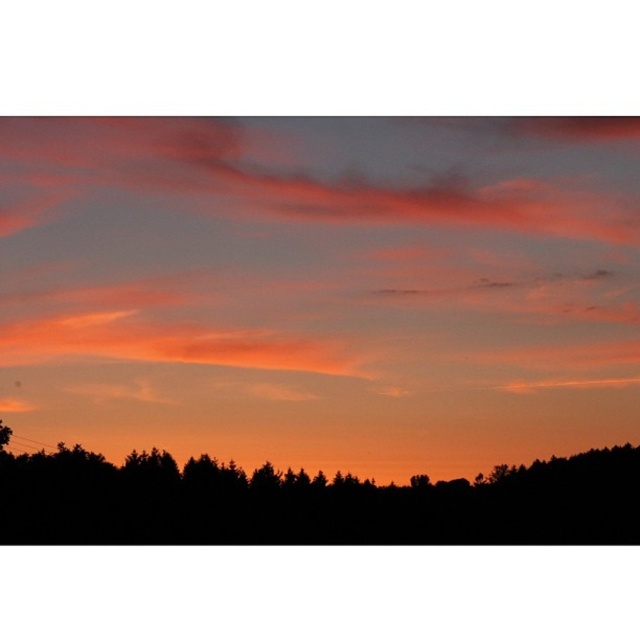
Question: Is matte orange cloud at upper center to the left of black silhouette tree at bottom from the viewer's perspective?

Choices:
 (A) no
 (B) yes

Answer: (B)

Question: Which point is farther to the camera?

Choices:
 (A) (179, 268)
 (B) (360, 532)

Answer: (B)

Question: Which point appears farthest from the camera in this image?

Choices:
 (A) (400, 497)
 (B) (81, 141)

Answer: (A)

Question: Is matte orange cloud at upper center to the right of black silhouette tree at bottom from the viewer's perspective?

Choices:
 (A) yes
 (B) no

Answer: (B)

Question: Among these objects, which one is nearest to the camera?

Choices:
 (A) black silhouette tree at bottom
 (B) matte orange cloud at upper center

Answer: (A)

Question: Is matte orange cloud at upper center bigger than black silhouette tree at bottom?

Choices:
 (A) no
 (B) yes

Answer: (A)